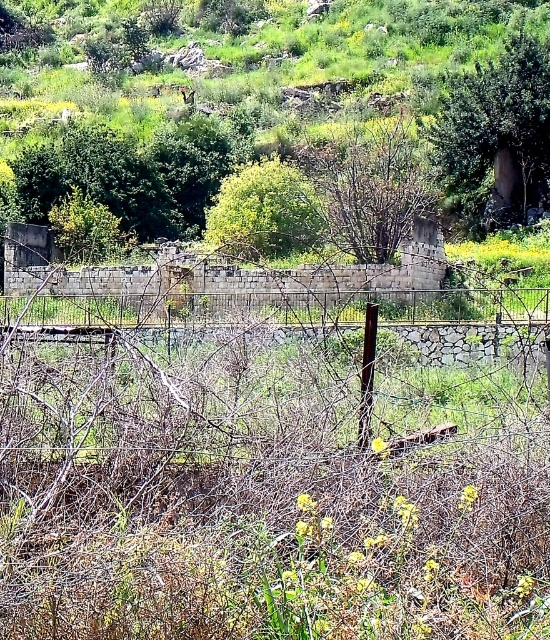
Question: Which point is closer to the camera taking this photo?

Choices:
 (A) (257, 164)
 (B) (397, 173)
 (C) (440, 134)

Answer: (A)

Question: Among these objects, which one is nearest to the camera?

Choices:
 (A) green leafy tree at center
 (B) green leafy tree at upper right
 (C) bare branches at center

Answer: (C)

Question: Is green leafy tree at upper right below bare branches at center?

Choices:
 (A) yes
 (B) no

Answer: (B)

Question: Which point is farther to the camera?

Choices:
 (A) green leafy tree at upper right
 (B) bare branches at center

Answer: (A)

Question: Is bare branches at center thinner than green leafy tree at center?

Choices:
 (A) no
 (B) yes

Answer: (A)

Question: Does green leafy tree at upper right appear on the right side of bare branches at center?

Choices:
 (A) yes
 (B) no

Answer: (A)